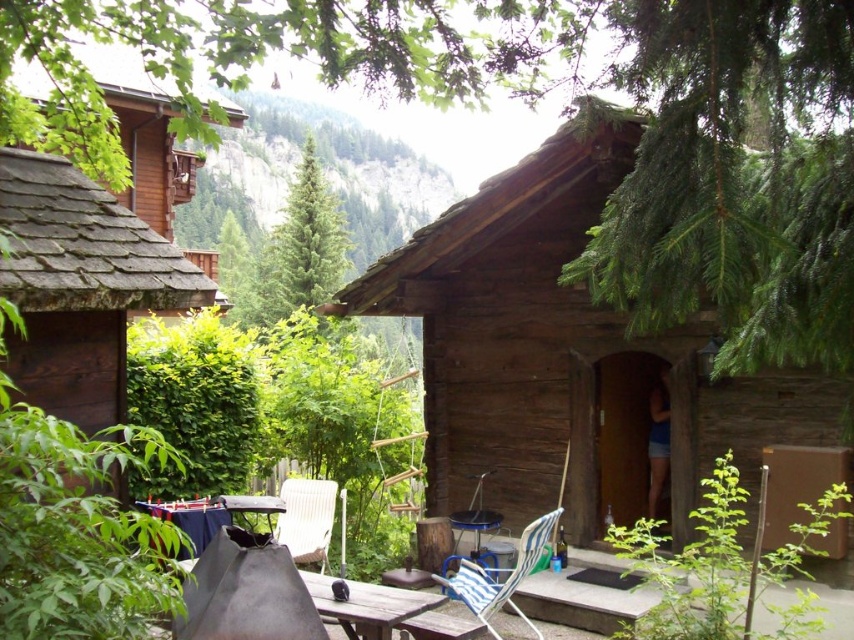
Does point (16, 163) come in front of point (227, 237)?

Yes.

Between wooden cabin at left and green textured tree at upper center, which one appears on the left side from the viewer's perspective?

From the viewer's perspective, green textured tree at upper center appears more on the left side.

Is point (62, 220) positioned behind point (229, 291)?

No.

The image size is (854, 640). I want to click on wooden cabin at left, so click(80, 285).

Is green coniferous tree at center thinner than blue striped fabric chair at lower center?

No.

From the picture: Can you confirm if green coniferous tree at center is positioned above blue striped fabric chair at lower center?

Correct, green coniferous tree at center is located above blue striped fabric chair at lower center.

In order to click on green coniferous tree at center in this screenshot , I will do `click(303, 244)`.

The image size is (854, 640). Describe the element at coordinates (367, 604) in the screenshot. I see `brown wooden table at lower center` at that location.

Does brown wooden table at lower center appear over wooden picnic table at center?

Incorrect, brown wooden table at lower center is not positioned above wooden picnic table at center.

Which is behind, point (385, 588) or point (192, 508)?

Point (192, 508)

Identify the location of brown wooden table at lower center. Image resolution: width=854 pixels, height=640 pixels. (367, 604).